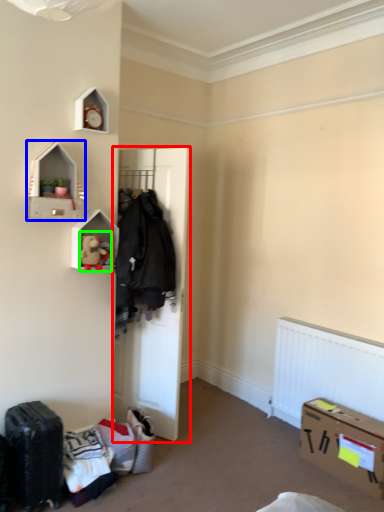
Question: Based on their relative distances, which object is farther from door (highlighted by a red box)? Choose from shelf (highlighted by a blue box) and toy (highlighted by a green box).

Choices:
 (A) shelf
 (B) toy

Answer: (A)